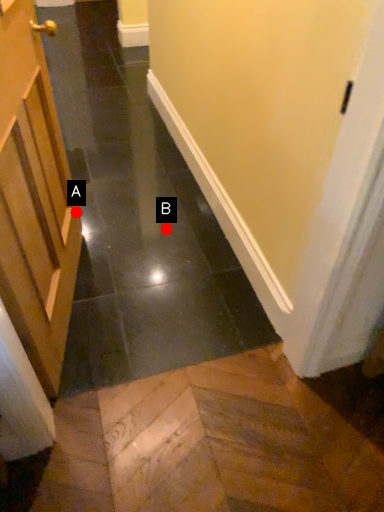
Question: Two points are circled on the image, labeled by A and B beside each circle. Which point is farther from the camera taking this photo?

Choices:
 (A) A is further
 (B) B is further

Answer: (B)